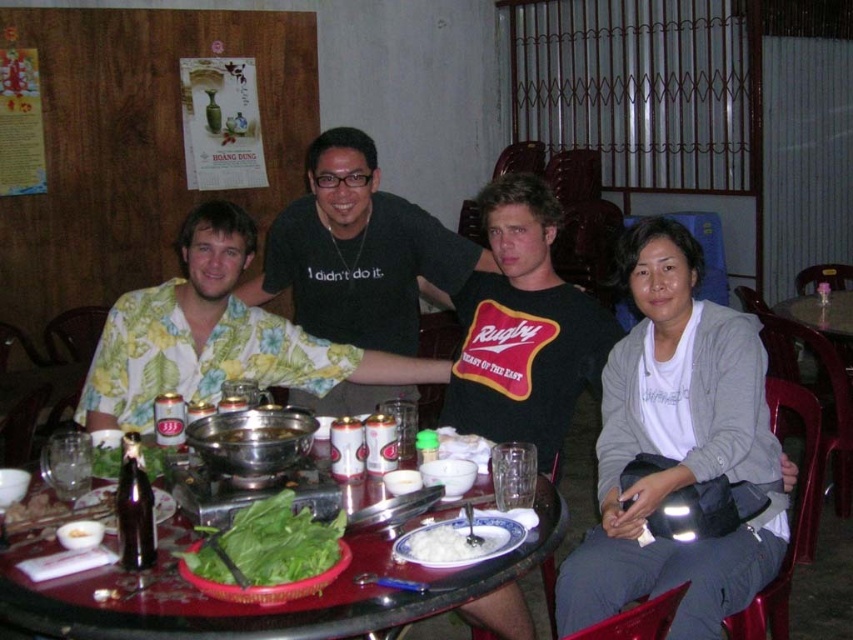
Question: Which point appears closest to the camera in this image?

Choices:
 (A) (471, 545)
 (B) (386, 200)
 (C) (215, 317)
 (D) (757, 340)

Answer: (A)

Question: Can you confirm if black matte shirt at center is positioned to the right of metallic red table at center?

Choices:
 (A) no
 (B) yes

Answer: (A)

Question: Among these points, which one is nearest to the camera?

Choices:
 (A) (183, 342)
 (B) (299, 554)
 (C) (341, 253)

Answer: (B)

Question: Where is white cotton shirt at center located in relation to green leafy vegetable at center in the image?

Choices:
 (A) above
 (B) below

Answer: (A)

Question: Is black matte shirt at center smaller than white creamy rice at center?

Choices:
 (A) no
 (B) yes

Answer: (A)

Question: Which of the following is the closest to the observer?

Choices:
 (A) (108, 392)
 (B) (236, 429)
 (C) (363, 257)
 (D) (225, 620)

Answer: (D)